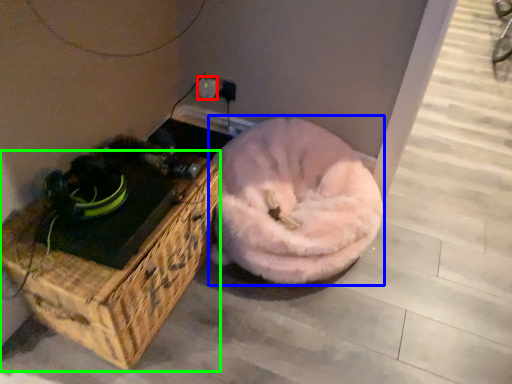
Question: Which object is the closest to the electric outlet (highlighted by a red box)? Choose among these: dog bed (highlighted by a blue box) or furniture (highlighted by a green box).

Choices:
 (A) dog bed
 (B) furniture

Answer: (A)